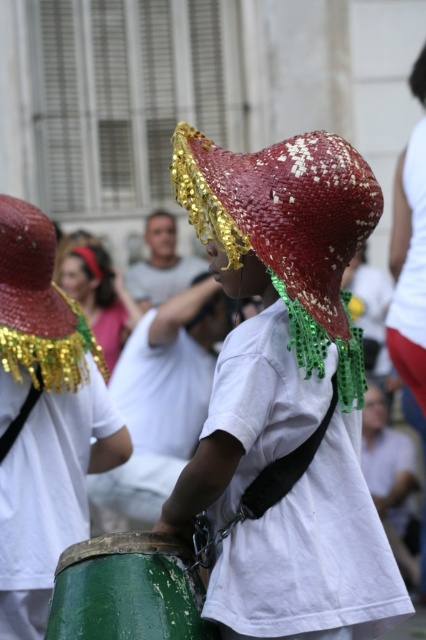
Is red woven hat at center smaller than green weathered wood drum at lower center?

Incorrect, red woven hat at center is not smaller in size than green weathered wood drum at lower center.

Which is behind, point (342, 168) or point (143, 612)?

Point (342, 168)

Where is `red woven hat at center`? The height and width of the screenshot is (640, 426). red woven hat at center is located at coordinates (285, 388).

Which is below, red straw hat at center or green weathered wood drum at lower center?

green weathered wood drum at lower center is lower down.

Does red straw hat at center appear under green weathered wood drum at lower center?

No.

Locate an element on the screen. red straw hat at center is located at coordinates (288, 230).

What do you see at coordinates (288, 230) in the screenshot?
I see `red straw hat at center` at bounding box center [288, 230].

The image size is (426, 640). Find the location of `red straw hat at center`. red straw hat at center is located at coordinates click(288, 230).

Identify the location of red straw hat at center. The height and width of the screenshot is (640, 426). (288, 230).